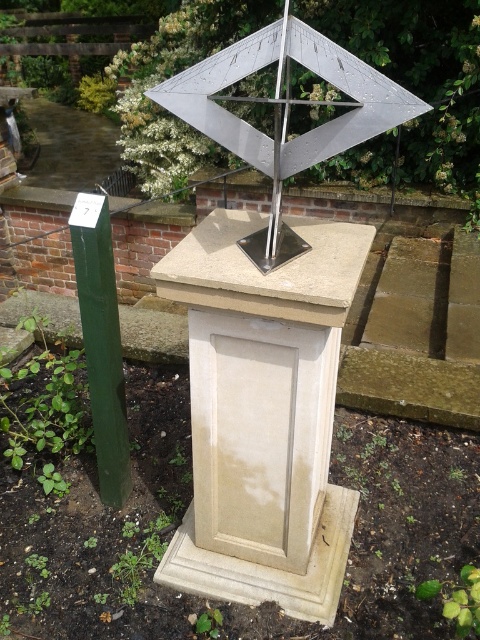
Question: Is beige stone pedestal at center to the right of green polished wood post at left from the viewer's perspective?

Choices:
 (A) no
 (B) yes

Answer: (B)

Question: Is beige stone pedestal at center below metallic silver sundial at center?

Choices:
 (A) yes
 (B) no

Answer: (A)

Question: Where is beige stone pedestal at center located in relation to metallic pole at center in the image?

Choices:
 (A) left
 (B) right

Answer: (A)

Question: Which point is closer to the camera?

Choices:
 (A) metallic pole at center
 (B) metallic silver sundial at center
 (C) green polished wood post at left

Answer: (B)

Question: Which is farther from the beige stone pedestal at center?

Choices:
 (A) green polished wood post at left
 (B) metallic pole at center

Answer: (B)

Question: Which of the following is the closest to the observer?

Choices:
 (A) (84, 220)
 (B) (276, 228)

Answer: (B)